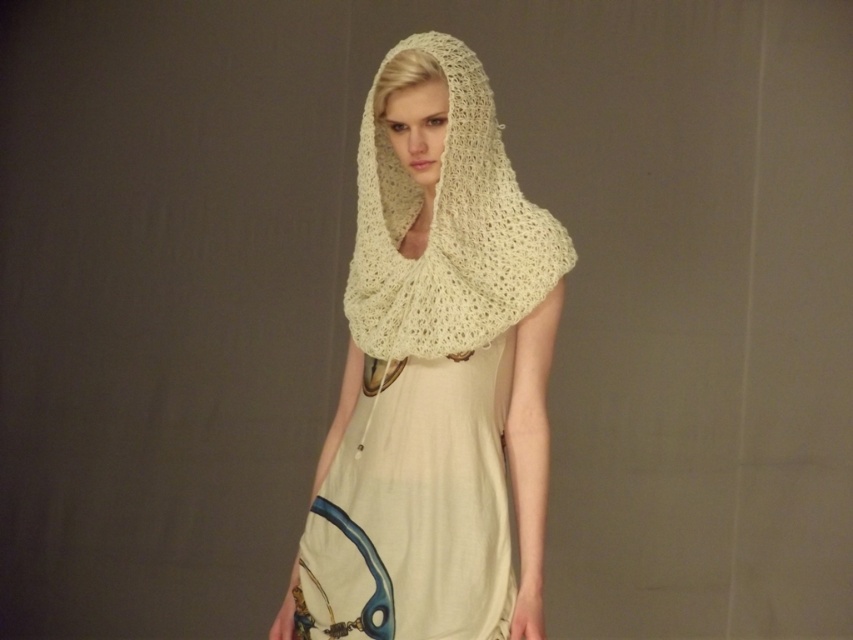
You are a fashion designer trying to layer the ivory knitted shawl at center over the light beige cotton dress at center for a photoshoot. Based on the size relationship between them, which garment should be placed on top to ensure proper visibility of both items?

The ivory knitted shawl at center has a larger size compared to light beige cotton dress at center, so placing the ivory knitted shawl at center on top will ensure that both garments are visible while maintaining the layered look.

You are a photographer standing 2 meters away from the light beige cotton dress at center. Can you capture the entire dress in your camera frame without moving closer?

The light beige cotton dress at center is 1.71 meters away from the viewer. Since you are standing 2 meters away, you are farther than the dress, so you can capture the entire dress in your camera frame without moving closer.

You are a fashion designer who needs to ensure the light beige cotton dress at center and the creamy knit shawl at center are displayed together in a photo shoot. The camera lens can only focus on objects within a 10 inch range. Will both items be in focus?

The distance between the light beige cotton dress at center and creamy knit shawl at center is 9.67 inches, which is within the 10 inch range, so both items will be in focus.